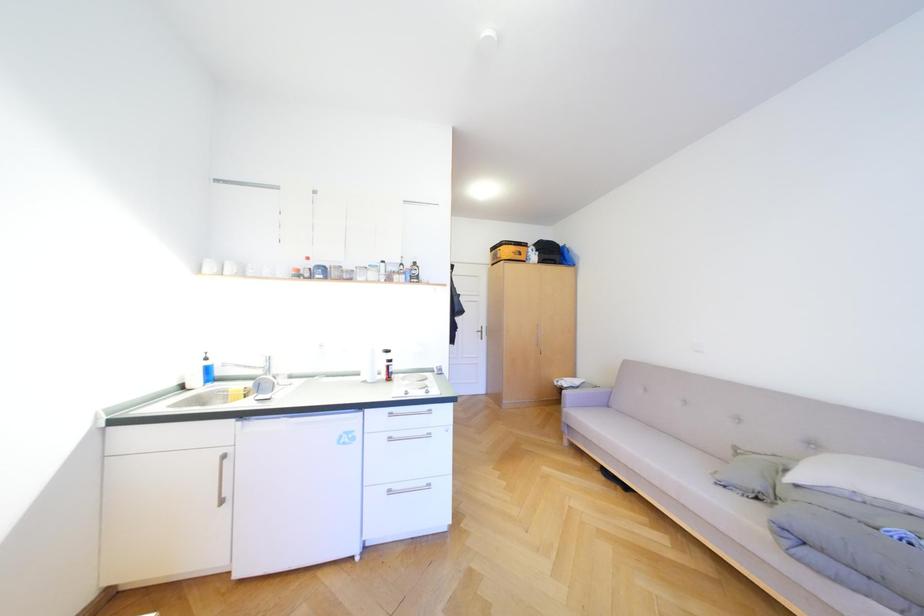
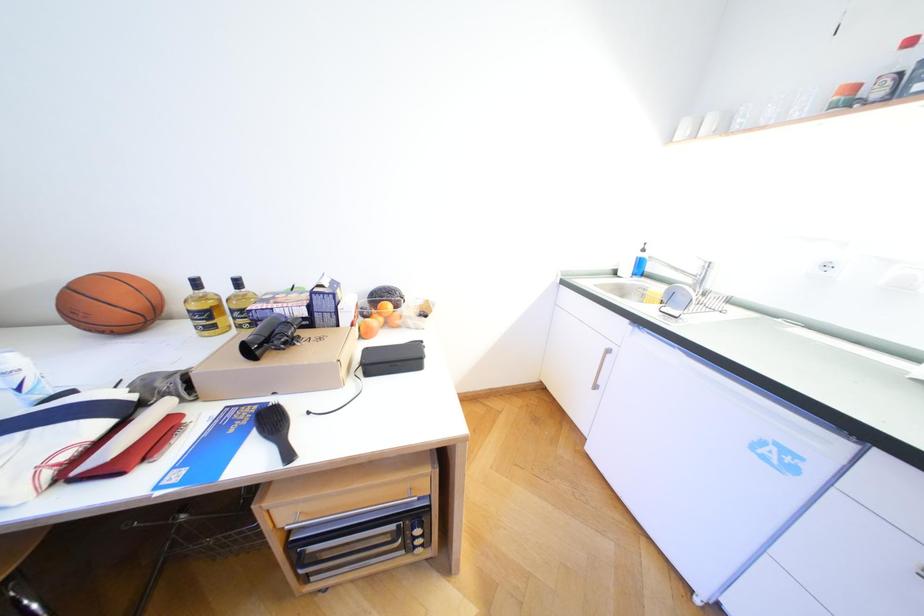
First-person continuous shooting, in which direction is the camera rotating?

The camera rotated toward left-down.